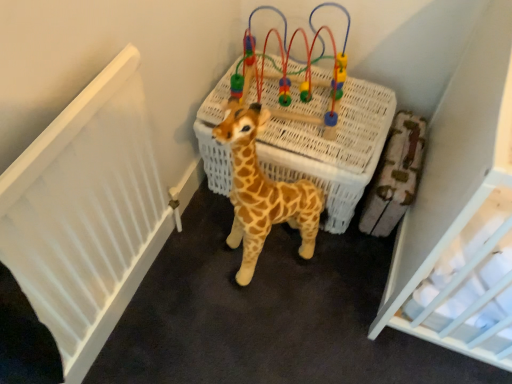
This screenshot has width=512, height=384. I want to click on vacant region under spotted plush giraffe at center (from a real-world perspective), so click(x=265, y=255).